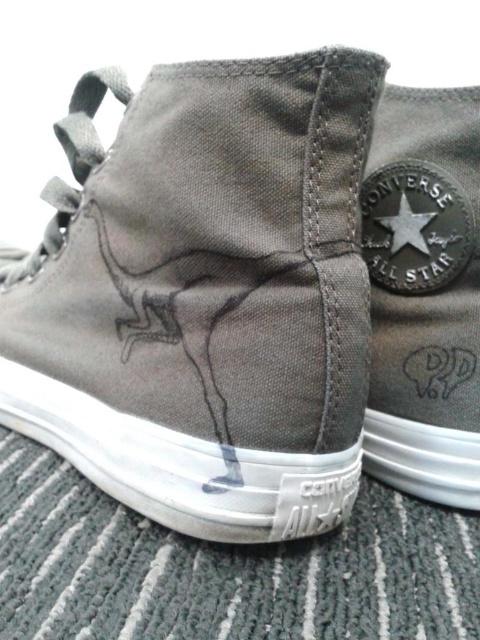
You are a customer in a shoe store trying to locate the exact pair of Converse All Star high top sneakers you saw in an online image. The store has multiple shoes displayed on a shelf. You remember that the pair you want has a specific point at coordinate (423,292). Can you determine if this point is on the matte canvas Converse All Star at center?

The point (423,292) corresponds to the matte canvas Converse All Star at center, so yes, the point is on the desired pair of sneakers.